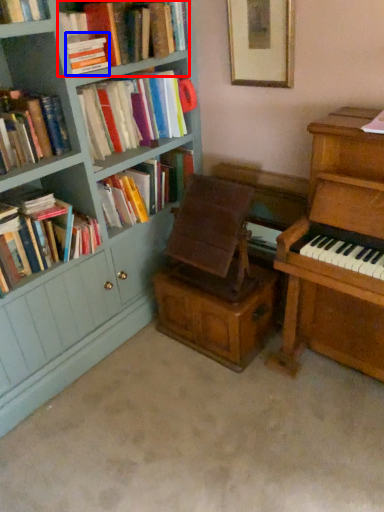
Question: Which object is further to the camera taking this photo, book (highlighted by a red box) or book (highlighted by a blue box)?

Choices:
 (A) book
 (B) book

Answer: (B)